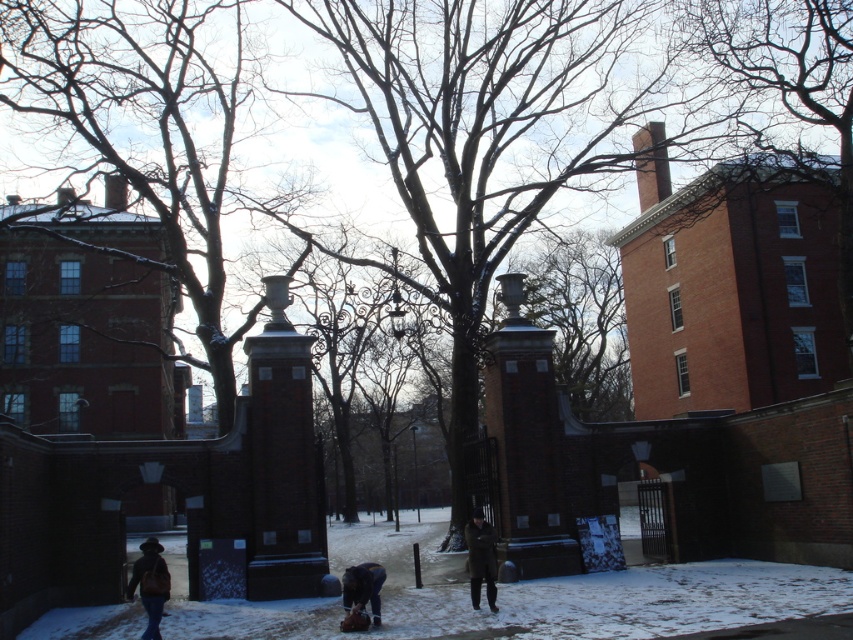
Question: Is dark brown leather coat at center wider than dark brown leather jacket at lower center?

Choices:
 (A) yes
 (B) no

Answer: (B)

Question: Estimate the real-world distances between objects in this image. Which object is farther from the bare branches at upper right?

Choices:
 (A) white powdery snow at center
 (B) dark brown leather jacket at lower center

Answer: (B)

Question: Which object is farther from the camera taking this photo?

Choices:
 (A) white powdery snow at center
 (B) bare branches at upper right
 (C) dark brown leather coat at center
 (D) dark brown leather jacket at lower left

Answer: (B)

Question: Which object appears farthest from the camera in this image?

Choices:
 (A) dark brown leather jacket at lower left
 (B) dark brown leather coat at center
 (C) dark brown leather jacket at lower center

Answer: (B)

Question: Can you confirm if dark brown leather coat at center is positioned below dark brown leather jacket at lower center?

Choices:
 (A) yes
 (B) no

Answer: (A)

Question: Is white powdery snow at center bigger than dark brown leather coat at center?

Choices:
 (A) no
 (B) yes

Answer: (B)